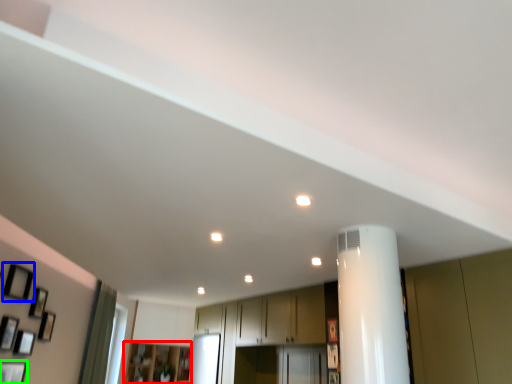
Question: Considering the real-world distances, which object is closest to cabinetry (highlighted by a red box)? picture frame (highlighted by a blue box) or picture frame (highlighted by a green box).

Choices:
 (A) picture frame
 (B) picture frame

Answer: (B)